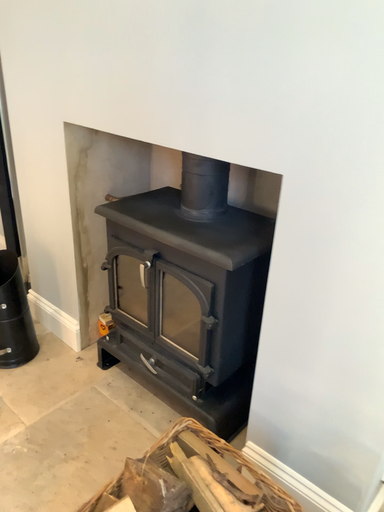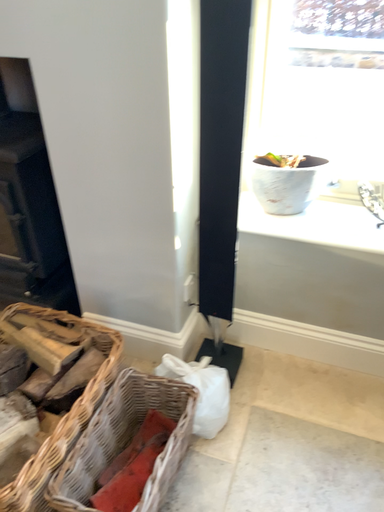
Question: Which way did the camera rotate in the video?

Choices:
 (A) rotated upward
 (B) rotated downward

Answer: (B)